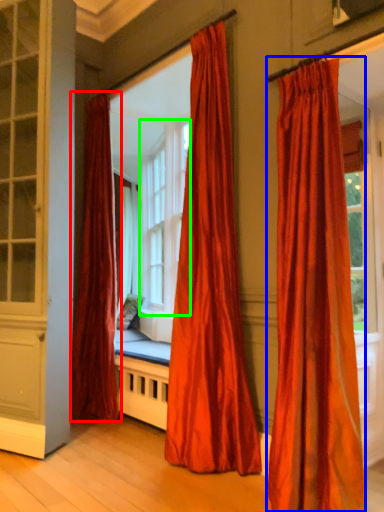
Question: Estimate the real-world distances between objects in this image. Which object is closer to curtain (highlighted by a red box), curtain (highlighted by a blue box) or bay window (highlighted by a green box)?

Choices:
 (A) curtain
 (B) bay window

Answer: (B)